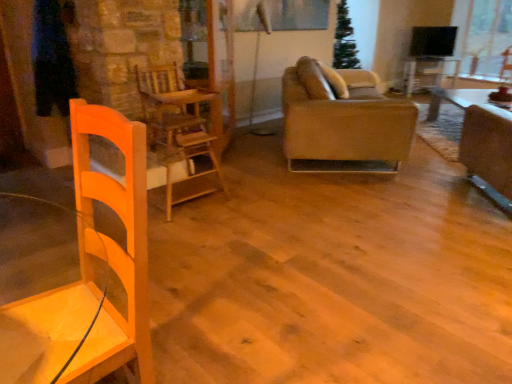
Find the location of a particular element. The image size is (512, 384). free location in front of wooden chair at center is located at coordinates (198, 230).